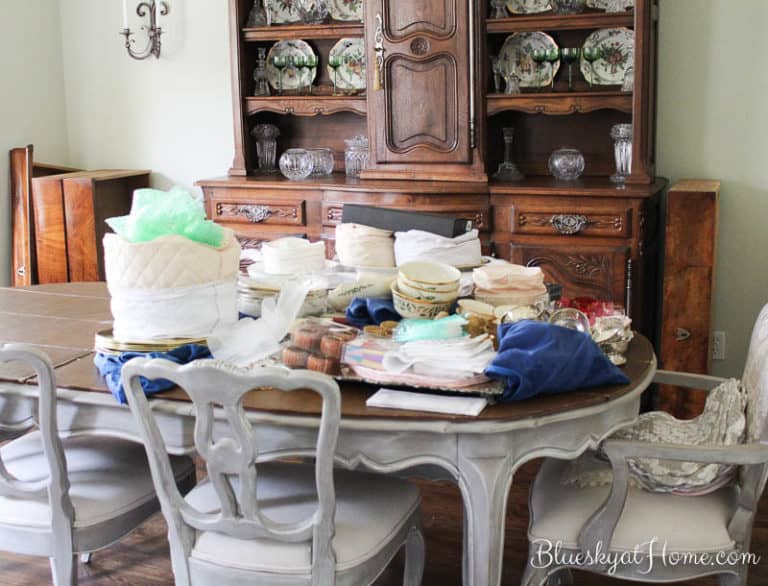
This screenshot has width=768, height=586. I want to click on long stem glasses, so click(x=280, y=61), click(x=295, y=59), click(x=305, y=59), click(x=338, y=59), click(x=537, y=54), click(x=548, y=54), click(x=564, y=53), click(x=587, y=50).